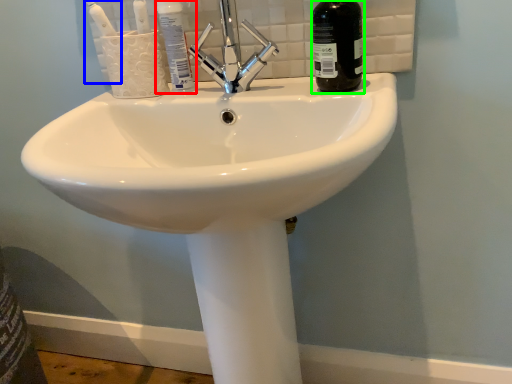
Question: Estimate the real-world distances between objects in this image. Which object is closer to mouthwash (highlighted by a red box), toothbrush (highlighted by a blue box) or bottle (highlighted by a green box)?

Choices:
 (A) toothbrush
 (B) bottle

Answer: (A)